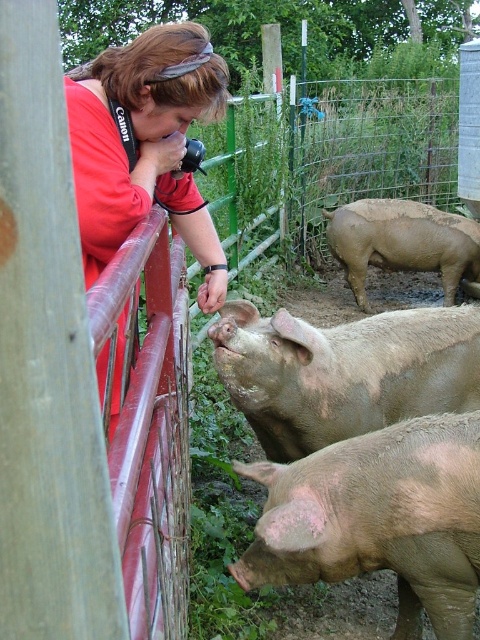
Question: Is brown matte pig at lower right further to the viewer compared to light brown muddy pig at center?

Choices:
 (A) no
 (B) yes

Answer: (A)

Question: Which of the following is the closest to the observer?

Choices:
 (A) (197, 48)
 (B) (347, 227)

Answer: (A)

Question: Does light brown muddy pig at center have a lesser width compared to matte red shirt at upper left?

Choices:
 (A) no
 (B) yes

Answer: (A)

Question: Is brown matte pig at lower right to the right of light brown muddy pig at center from the viewer's perspective?

Choices:
 (A) no
 (B) yes

Answer: (B)

Question: Estimate the real-world distances between objects in this image. Which object is closer to the light brown muddy pig at center?

Choices:
 (A) brown muddy pig at center
 (B) matte red shirt at upper left

Answer: (B)

Question: Which point is farther from the camera taking this photo?

Choices:
 (A) (275, 392)
 (B) (94, 225)

Answer: (A)